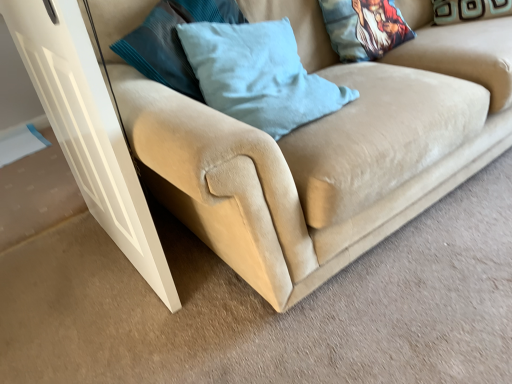
Question: Which direction should I rotate to look at light blue fabric pillow at center, arranged as the first pillow when viewed from the left?

Choices:
 (A) left
 (B) right

Answer: (B)

Question: Could beige suede couch at lower left be considered to be inside printed fabric pillow at upper right, the 2th pillow viewed from the right?

Choices:
 (A) no
 (B) yes

Answer: (A)

Question: Is printed fabric pillow at upper right, the 2th pillow viewed from the right, located outside beige suede couch at lower left?

Choices:
 (A) no
 (B) yes

Answer: (A)

Question: Is the position of printed fabric pillow at upper right, the 2th pillow viewed from the right, more distant than that of beige suede couch at lower left?

Choices:
 (A) yes
 (B) no

Answer: (A)

Question: Does printed fabric pillow at upper right, the 2th pillow from the left, have a lesser height compared to beige suede couch at lower left?

Choices:
 (A) no
 (B) yes

Answer: (B)

Question: Is beige suede couch at lower left at the back of printed fabric pillow at upper right, the 2th pillow from the left?

Choices:
 (A) no
 (B) yes

Answer: (B)

Question: Is printed fabric pillow at upper right, the 2th pillow from the left, to the left of beige suede couch at lower left from the viewer's perspective?

Choices:
 (A) no
 (B) yes

Answer: (B)

Question: Can you confirm if light blue fabric pillow at center, arranged as the first pillow when viewed from the left, is shorter than printed fabric pillow at upper right, the 2th pillow viewed from the right?

Choices:
 (A) no
 (B) yes

Answer: (A)

Question: Can you confirm if light blue fabric pillow at center, arranged as the first pillow when viewed from the left, is thinner than printed fabric pillow at upper right, the 2th pillow viewed from the right?

Choices:
 (A) no
 (B) yes

Answer: (A)

Question: Is printed fabric pillow at upper right, the 2th pillow from the left, at the back of light blue fabric pillow at center, arranged as the first pillow when viewed from the left?

Choices:
 (A) yes
 (B) no

Answer: (B)

Question: Is the position of light blue fabric pillow at center, arranged as the first pillow when viewed from the left, more distant than that of printed fabric pillow at upper right, the 2th pillow viewed from the right?

Choices:
 (A) yes
 (B) no

Answer: (B)

Question: Can we say light blue fabric pillow at center, the third pillow when ordered from right to left, lies outside printed fabric pillow at upper right, the 2th pillow from the left?

Choices:
 (A) no
 (B) yes

Answer: (B)

Question: Could you tell me if light blue fabric pillow at center, arranged as the first pillow when viewed from the left, is turned towards printed fabric pillow at upper right, the 2th pillow from the left?

Choices:
 (A) no
 (B) yes

Answer: (A)

Question: Does teal velvet pillow at upper right, which is the third pillow from left to right, have a smaller size compared to light blue fabric pillow at center, the third pillow when ordered from right to left?

Choices:
 (A) no
 (B) yes

Answer: (B)